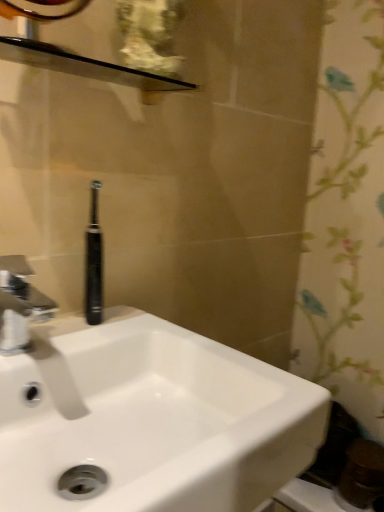
The width and height of the screenshot is (384, 512). Identify the location of black rubber toothbrush at center. (94, 262).

Measure the distance between point (x=101, y=184) and camera.

The depth of point (x=101, y=184) is 29.49 inches.

At what (x,y) coordinates should I click in order to perform the action: click on white glossy sink at center. Please return your answer as a coordinate pair (x, y). Looking at the image, I should click on (141, 413).

Locate an element on the screen. The width and height of the screenshot is (384, 512). silver metallic faucet at left is located at coordinates (19, 305).

Where is `black glossy balustrade at upper center`? Image resolution: width=384 pixels, height=512 pixels. black glossy balustrade at upper center is located at coordinates (85, 66).

Identify the location of black rubber toothbrush at center. (94, 262).

Can you confirm if white glossy sink at center is smaller than black rubber toothbrush at center?

Incorrect, white glossy sink at center is not smaller in size than black rubber toothbrush at center.

Is white glossy sink at center at the left side of black rubber toothbrush at center?

No.

From a real-world perspective, is white glossy sink at center above or below black rubber toothbrush at center?

From a real-world perspective, white glossy sink at center is physically below black rubber toothbrush at center.

Locate an element on the screen. balustrade above the silver metallic faucet at left (from a real-world perspective) is located at coordinates (85, 66).

From a real-world perspective, is black glossy balustrade at upper center physically above silver metallic faucet at left?

Indeed, from a real-world perspective, black glossy balustrade at upper center stands above silver metallic faucet at left.

From their relative heights in the image, would you say black glossy balustrade at upper center is taller or shorter than silver metallic faucet at left?

Clearly, black glossy balustrade at upper center is shorter compared to silver metallic faucet at left.

Is black glossy balustrade at upper center looking in the opposite direction of black rubber toothbrush at center?

No.

Is black glossy balustrade at upper center positioned far away from black rubber toothbrush at center?

black glossy balustrade at upper center is near black rubber toothbrush at center, not far away.

Could black rubber toothbrush at center be considered to be inside black glossy balustrade at upper center?

No, black glossy balustrade at upper center does not contain black rubber toothbrush at center.

From a real-world perspective, between black glossy balustrade at upper center and black rubber toothbrush at center, who is vertically lower?

In real-world perspective, black rubber toothbrush at center is lower.

Is silver metallic faucet at left thinner than white glossy sink at center?

Indeed, silver metallic faucet at left has a lesser width compared to white glossy sink at center.

From a real-world perspective, is silver metallic faucet at left on top of white glossy sink at center?

Indeed, from a real-world perspective, silver metallic faucet at left stands above white glossy sink at center.

Measure the distance between silver metallic faucet at left and white glossy sink at center.

silver metallic faucet at left is 6.68 inches from white glossy sink at center.

Is silver metallic faucet at left directly adjacent to white glossy sink at center?

No, silver metallic faucet at left is not next to white glossy sink at center.

From a real-world perspective, is black rubber toothbrush at center under silver metallic faucet at left?

Actually, black rubber toothbrush at center is physically above silver metallic faucet at left in the real world.

Is silver metallic faucet at left inside black rubber toothbrush at center?

No, black rubber toothbrush at center does not contain silver metallic faucet at left.

Is black rubber toothbrush at center aimed at silver metallic faucet at left?

No, black rubber toothbrush at center is not facing towards silver metallic faucet at left.

Which of these two, black rubber toothbrush at center or silver metallic faucet at left, is thinner?

Thinner between the two is black rubber toothbrush at center.

From their relative heights in the image, would you say silver metallic faucet at left is taller or shorter than black rubber toothbrush at center?

In the image, silver metallic faucet at left appears to be shorter than black rubber toothbrush at center.

Would you say silver metallic faucet at left is outside black rubber toothbrush at center?

Yes.

From the image's perspective, which is above, black glossy balustrade at upper center or white glossy sink at center?

From the image's view, black glossy balustrade at upper center is above.

Can you confirm if black glossy balustrade at upper center is shorter than white glossy sink at center?

Yes, black glossy balustrade at upper center is shorter than white glossy sink at center.

From a real-world perspective, is black glossy balustrade at upper center located beneath white glossy sink at center?

No, from a real-world perspective, black glossy balustrade at upper center is not below white glossy sink at center.

Is black glossy balustrade at upper center wider than white glossy sink at center?

No, black glossy balustrade at upper center is not wider than white glossy sink at center.

You are a GUI agent. You are given a task and a screenshot of the screen. Output one action in this format:
    pyautogui.click(x=<x>, y=<y>)
    Task: Click on the toiletry lying on the left of white glossy sink at center
    Image resolution: width=384 pixels, height=512 pixels.
    Given the screenshot: What is the action you would take?
    pyautogui.click(x=94, y=262)

Identify the location of tap that appears below the black glossy balustrade at upper center (from the image's perspective). (19, 305).

Estimate the real-world distances between objects in this image. Which object is closer to white glossy sink at center, black glossy balustrade at upper center or black rubber toothbrush at center?

Based on the image, black rubber toothbrush at center appears to be nearer to white glossy sink at center.

From the image, which object appears to be nearer to silver metallic faucet at left, black rubber toothbrush at center or black glossy balustrade at upper center?

The object closer to silver metallic faucet at left is black rubber toothbrush at center.

Considering their positions, is white glossy sink at center positioned further to black glossy balustrade at upper center than black rubber toothbrush at center?

Based on the image, white glossy sink at center appears to be further to black glossy balustrade at upper center.

Which object lies further to the anchor point white glossy sink at center, silver metallic faucet at left or black glossy balustrade at upper center?

black glossy balustrade at upper center is positioned further to the anchor white glossy sink at center.

Looking at this image, based on their spatial positions, is black glossy balustrade at upper center or white glossy sink at center further from black rubber toothbrush at center?

black glossy balustrade at upper center lies further to black rubber toothbrush at center than the other object.

When comparing their distances from black glossy balustrade at upper center, does black rubber toothbrush at center or silver metallic faucet at left seem further?

Among the two, silver metallic faucet at left is located further to black glossy balustrade at upper center.

From the image, which object appears to be farther from black rubber toothbrush at center, silver metallic faucet at left or white glossy sink at center?

white glossy sink at center.

Based on their spatial positions, is black glossy balustrade at upper center or white glossy sink at center further from silver metallic faucet at left?

black glossy balustrade at upper center.

Where is `tap between black glossy balustrade at upper center and white glossy sink at center vertically`? The image size is (384, 512). tap between black glossy balustrade at upper center and white glossy sink at center vertically is located at coordinates (19, 305).

Locate an element on the screen. This screenshot has height=512, width=384. tap between white glossy sink at center and black rubber toothbrush at center along the z-axis is located at coordinates (19, 305).

The width and height of the screenshot is (384, 512). Identify the location of toiletry between black glossy balustrade at upper center and silver metallic faucet at left in the vertical direction. (94, 262).

You are a GUI agent. You are given a task and a screenshot of the screen. Output one action in this format:
    pyautogui.click(x=<x>, y=<y>)
    Task: Click on the toiletry between black glossy balustrade at upper center and white glossy sink at center in the up-down direction
    This screenshot has width=384, height=512.
    Given the screenshot: What is the action you would take?
    pyautogui.click(x=94, y=262)